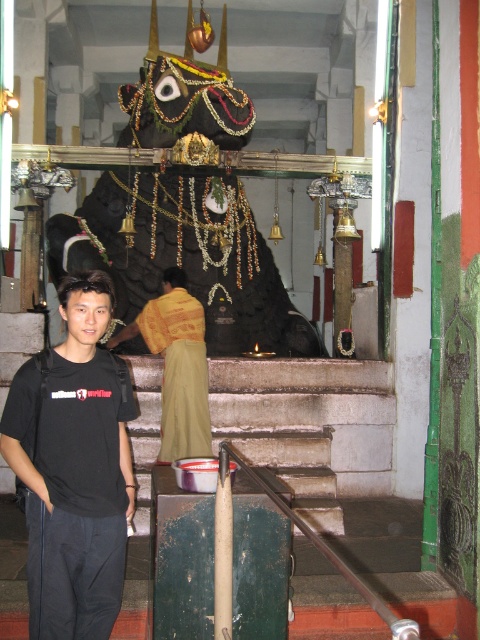
Based on the photo, you are a photographer setting up a shot of the temple idol. You notice the black cotton shirt at lower left and the yellow textured cloth at center. Which object should you focus on first if you want to capture both in the same frame?

The black cotton shirt at lower left is located below the yellow textured cloth at center, so you should focus on the yellow textured cloth at center first to ensure both are in the frame.

You are a photographer setting up a shoot in this temple scene. You have to place a small decorative item between the black cotton shirt at lower left and the yellow textured cloth at center. Considering their sizes, which object should the item be closer to?

The black cotton shirt at lower left has a smaller size compared to yellow textured cloth at center, so the decorative item should be placed closer to the yellow textured cloth at center to balance the composition.

You are standing in the temple and want to take a photo of the idol. You notice two points marked in the scene. The first point is at coordinate point(68, 451) and the second is at point(188, 388). Which point is closer to you?

Point(68, 451) is closer to the camera than point(188, 388).